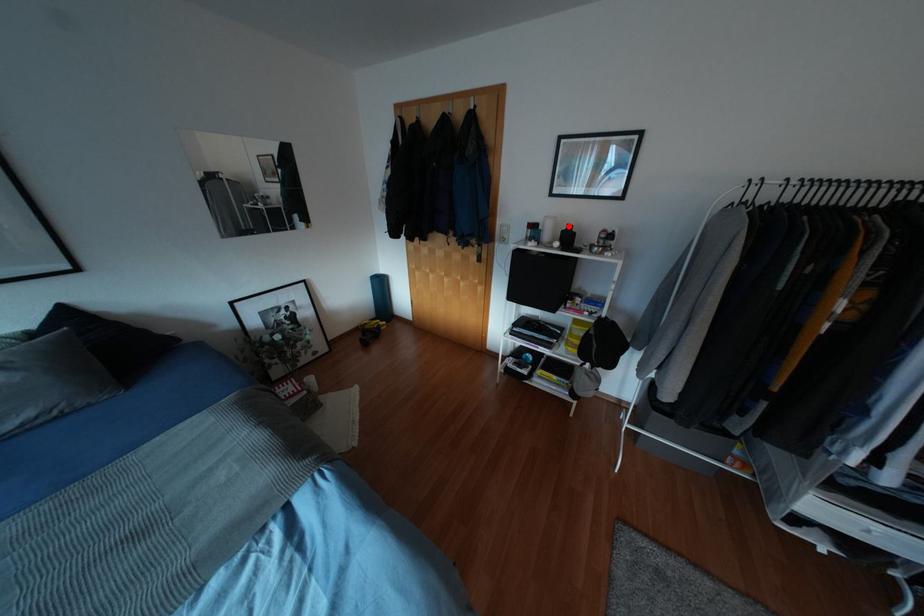
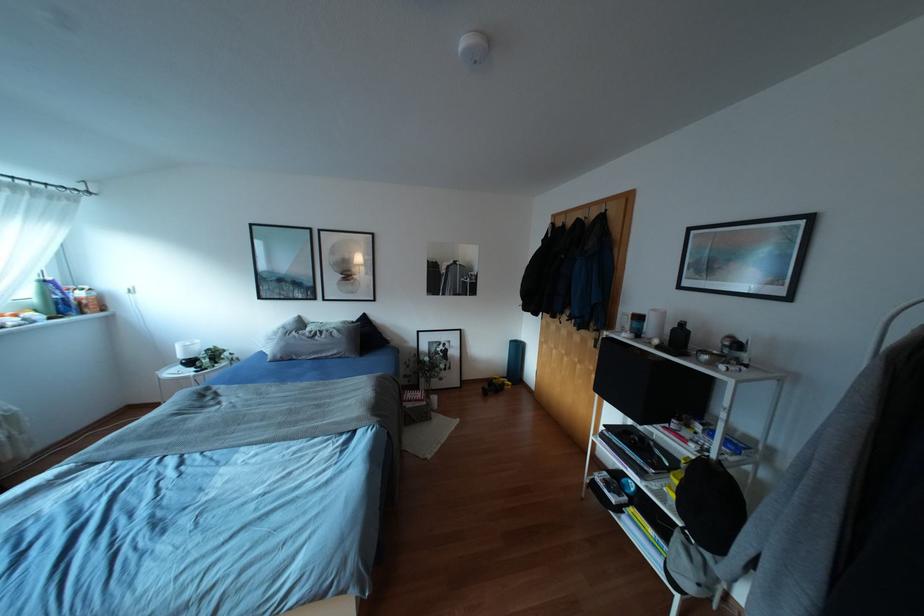
Where in the second image is the point corresponding to the highlighted location from the first image?

(682, 323)